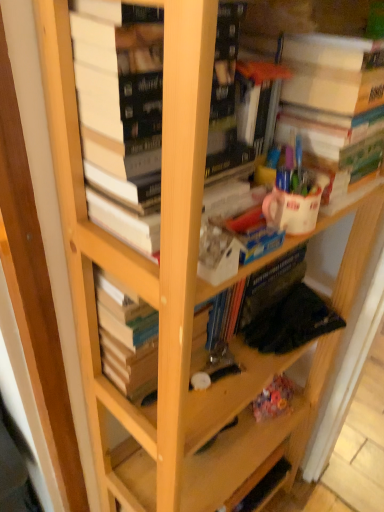
Question: Considering the relative positions of white matte paper at upper right, marked as the third book in a left-to-right arrangement, and hardcover books at center, marked as the second book in a right-to-left arrangement, in the image provided, is white matte paper at upper right, marked as the third book in a left-to-right arrangement, to the right of hardcover books at center, marked as the second book in a right-to-left arrangement, from the viewer's perspective?

Choices:
 (A) no
 (B) yes

Answer: (B)

Question: Can you confirm if white matte paper at upper right, marked as the third book in a left-to-right arrangement, is shorter than hardcover books at center, marked as the second book in a left-to-right arrangement?

Choices:
 (A) yes
 (B) no

Answer: (A)

Question: Is white matte paper at upper right, marked as the third book in a left-to-right arrangement, behind hardcover books at center, marked as the second book in a right-to-left arrangement?

Choices:
 (A) yes
 (B) no

Answer: (A)

Question: Is white matte paper at upper right, acting as the first book starting from the right, positioned before hardcover books at center, marked as the second book in a left-to-right arrangement?

Choices:
 (A) yes
 (B) no

Answer: (B)

Question: Is white matte paper at upper right, acting as the first book starting from the right, not near hardcover books at center, marked as the second book in a left-to-right arrangement?

Choices:
 (A) yes
 (B) no

Answer: (B)

Question: From a real-world perspective, is white matte paper at upper right, marked as the third book in a left-to-right arrangement, located higher than hardcover books at center, marked as the second book in a left-to-right arrangement?

Choices:
 (A) yes
 (B) no

Answer: (B)

Question: Does hardcover book at center, which ranks as the 3th book in right-to-left order, have a greater width compared to hardcover books at center, marked as the second book in a right-to-left arrangement?

Choices:
 (A) no
 (B) yes

Answer: (A)

Question: Is hardcover book at center, positioned as the 1th book in left-to-right order, oriented away from hardcover books at center, marked as the second book in a right-to-left arrangement?

Choices:
 (A) yes
 (B) no

Answer: (B)

Question: Is hardcover books at center, marked as the second book in a left-to-right arrangement, a part of hardcover book at center, positioned as the 1th book in left-to-right order?

Choices:
 (A) no
 (B) yes

Answer: (A)

Question: Does hardcover book at center, which ranks as the 3th book in right-to-left order, appear on the right side of hardcover books at center, marked as the second book in a left-to-right arrangement?

Choices:
 (A) yes
 (B) no

Answer: (B)

Question: Considering the relative sizes of hardcover book at center, positioned as the 1th book in left-to-right order, and hardcover books at center, marked as the second book in a left-to-right arrangement, in the image provided, is hardcover book at center, positioned as the 1th book in left-to-right order, smaller than hardcover books at center, marked as the second book in a left-to-right arrangement,?

Choices:
 (A) no
 (B) yes

Answer: (B)

Question: From the image's perspective, would you say hardcover book at center, positioned as the 1th book in left-to-right order, is shown under hardcover books at center, marked as the second book in a left-to-right arrangement?

Choices:
 (A) yes
 (B) no

Answer: (A)

Question: Can you confirm if white matte paper at upper right, acting as the first book starting from the right, is positioned to the right of hardcover book at center, positioned as the 1th book in left-to-right order?

Choices:
 (A) yes
 (B) no

Answer: (A)